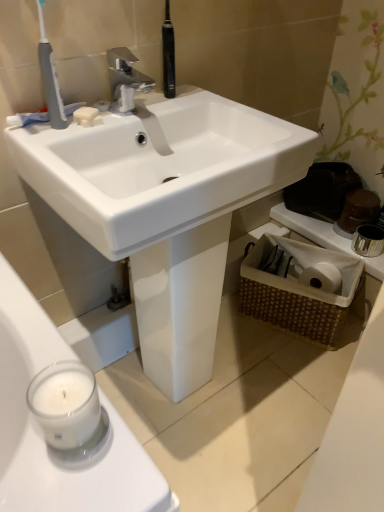
Locate an element on the screen. Image resolution: width=384 pixels, height=512 pixels. free space in front of white matte toothpaste at upper left is located at coordinates pyautogui.click(x=47, y=139).